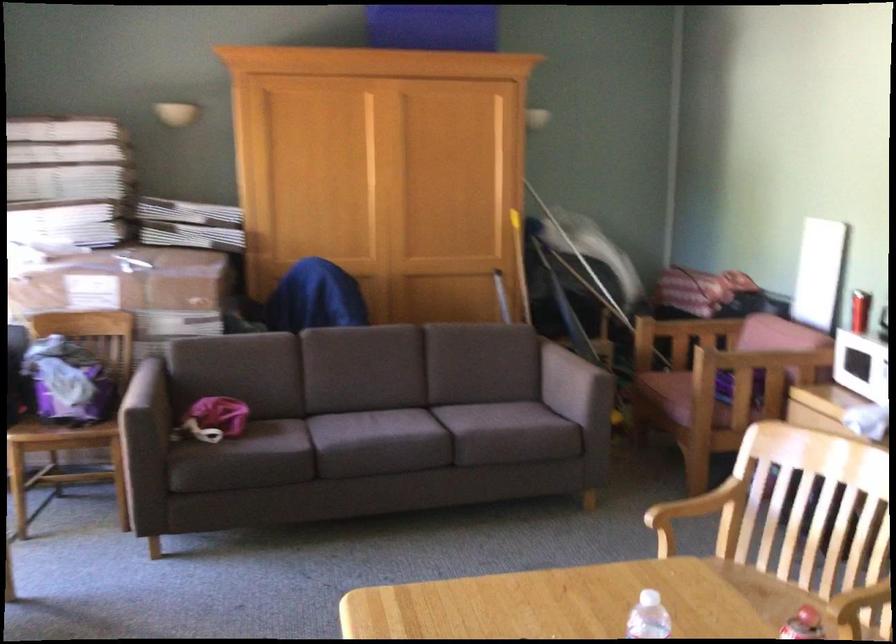
What do you see at coordinates (555, 603) in the screenshot? I see `the wooden chair surface` at bounding box center [555, 603].